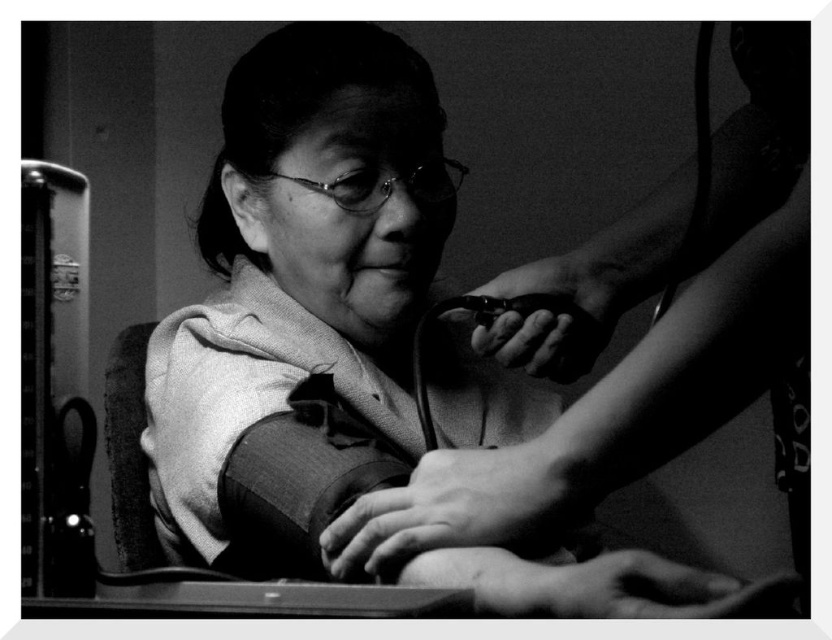
Is smooth plastic comb at upper center wider than black matte hair at upper center?

Correct, the width of smooth plastic comb at upper center exceeds that of black matte hair at upper center.

Does point (573, 492) come behind point (359, 49)?

That is False.

This screenshot has height=640, width=832. What are the coordinates of `smooth plastic comb at upper center` in the screenshot? It's located at (652, 339).